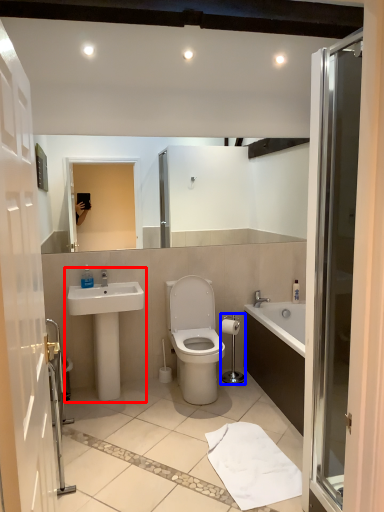
Question: Which object is closer to the camera taking this photo, sink (highlighted by a red box) or towel bar (highlighted by a blue box)?

Choices:
 (A) sink
 (B) towel bar

Answer: (A)